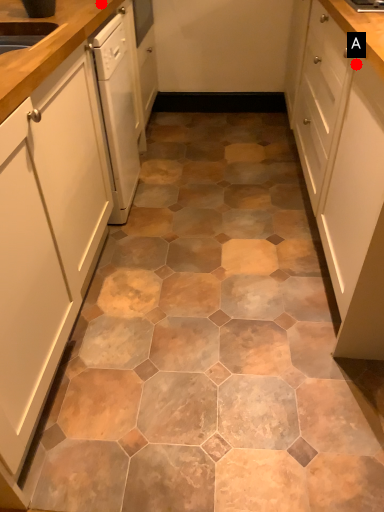
Question: Two points are circled on the image, labeled by A and B beside each circle. Which of the following is the farthest from the observer?

Choices:
 (A) A is further
 (B) B is further

Answer: (B)